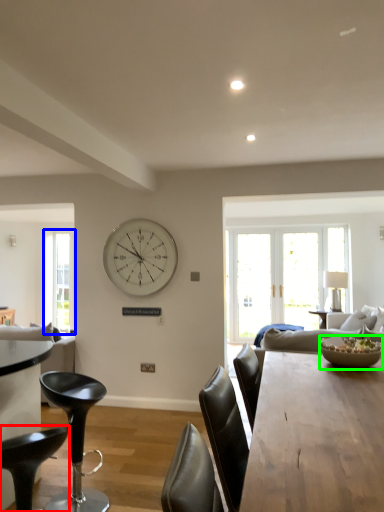
Question: Based on their relative distances, which object is farther from chair (highlighted by a red box)? Choose from window (highlighted by a blue box) and bowl (highlighted by a green box).

Choices:
 (A) window
 (B) bowl

Answer: (A)